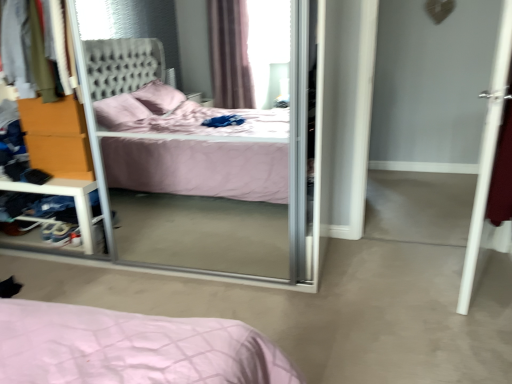
This screenshot has height=384, width=512. Describe the element at coordinates (64, 195) in the screenshot. I see `clear plastic shelf at left` at that location.

Locate an element on the screen. Image resolution: width=512 pixels, height=384 pixels. clear plastic shelf at left is located at coordinates (64, 195).

At what (x,y) coordinates should I click in order to perform the action: click on transparent glass screen door at center. Please return your answer as a coordinate pair (x, y). The width and height of the screenshot is (512, 384). Looking at the image, I should click on tap(202, 169).

Image resolution: width=512 pixels, height=384 pixels. I want to click on white smooth door at right, so [x=487, y=154].

The image size is (512, 384). Identify the location of clothing in front of the orange wood dresser at left. (27, 48).

Is point (79, 107) closer to viewer compared to point (19, 90)?

No, it is behind (19, 90).

What's the angular difference between orange wood dresser at left and velvet fabric sweater at upper left's facing directions?

The angle between the facing direction of orange wood dresser at left and the facing direction of velvet fabric sweater at upper left is 2.08 degrees.

In the scene shown: From the image's perspective, between orange wood dresser at left and clear plastic shelf at left, who is located below?

clear plastic shelf at left.

I want to click on dresser on the right of clear plastic shelf at left, so click(57, 137).

Does point (34, 141) come farther from viewer compared to point (64, 194)?

That is False.

Based on the photo, from a real-world perspective, which is physically below, orange wood dresser at left or clear plastic shelf at left?

clear plastic shelf at left, from a real-world perspective.

Which is more to the right, clear plastic shelf at left or white smooth door at right?

From the viewer's perspective, white smooth door at right appears more on the right side.

What's the angular difference between clear plastic shelf at left and white smooth door at right's facing directions?

110 degrees separate the facing orientations of clear plastic shelf at left and white smooth door at right.

Is clear plastic shelf at left next to white smooth door at right and touching it?

They are not placed beside each other.

Which is closer to the camera, (11, 3) or (74, 181)?

Point (11, 3) is closer to the camera than point (74, 181).

Can you confirm if velvet fabric sweater at upper left is shorter than clear plastic shelf at left?

In fact, velvet fabric sweater at upper left may be taller than clear plastic shelf at left.

The image size is (512, 384). What are the coordinates of `clothing in front of the clear plastic shelf at left` in the screenshot? It's located at (27, 48).

Which object is wider, white smooth door at right or transparent glass screen door at center?

Wider between the two is transparent glass screen door at center.

Is white smooth door at right completely or partially outside of transparent glass screen door at center?

white smooth door at right lies outside transparent glass screen door at center's area.

How many degrees apart are the facing directions of white smooth door at right and transparent glass screen door at center?

The angle between the facing direction of white smooth door at right and the facing direction of transparent glass screen door at center is 111 degrees.

Can you confirm if white smooth door at right is positioned to the right of transparent glass screen door at center?

Yes.

Between velvet fabric sweater at upper left and white smooth door at right, which one appears on the left side from the viewer's perspective?

Positioned to the left is velvet fabric sweater at upper left.

How different are the orientations of velvet fabric sweater at upper left and white smooth door at right in degrees?

There is a 110-degree angle between the facing directions of velvet fabric sweater at upper left and white smooth door at right.

Does point (44, 43) come behind point (506, 71)?

No, (44, 43) is in front of (506, 71).

From the image's perspective, which object appears higher, velvet fabric sweater at upper left or white smooth door at right?

velvet fabric sweater at upper left, from the image's perspective.

Which is in front, clear plastic shelf at left or velvet fabric sweater at upper left?

Positioned in front is velvet fabric sweater at upper left.

Is clear plastic shelf at left surrounding velvet fabric sweater at upper left?

No, velvet fabric sweater at upper left is not inside clear plastic shelf at left.

Is clear plastic shelf at left oriented away from velvet fabric sweater at upper left?

No, clear plastic shelf at left is not facing away from velvet fabric sweater at upper left.

In the scene shown: Based on their sizes in the image, would you say clear plastic shelf at left is bigger or smaller than velvet fabric sweater at upper left?

Considering their sizes, clear plastic shelf at left takes up less space than velvet fabric sweater at upper left.

In order to click on dresser located underneath the velvet fabric sweater at upper left (from a real-world perspective) in this screenshot , I will do 57,137.

Locate an element on the screen. vanity below the orange wood dresser at left (from the image's perspective) is located at coordinates (64, 195).

From the image, which object appears to be nearer to white smooth door at right, clear plastic shelf at left or velvet fabric sweater at upper left?

clear plastic shelf at left.

Looking at the image, which one is located further to orange wood dresser at left, clear plastic shelf at left or white smooth door at right?

The object further to orange wood dresser at left is white smooth door at right.

Considering their positions, is transparent glass screen door at center positioned closer to clear plastic shelf at left than orange wood dresser at left?

The object closer to clear plastic shelf at left is orange wood dresser at left.

Estimate the real-world distances between objects in this image. Which object is closer to clear plastic shelf at left, velvet fabric sweater at upper left or orange wood dresser at left?

Among the two, orange wood dresser at left is located nearer to clear plastic shelf at left.

Looking at the image, which one is located closer to transparent glass screen door at center, velvet fabric sweater at upper left or white smooth door at right?

velvet fabric sweater at upper left is positioned closer to the anchor transparent glass screen door at center.

Looking at the image, which one is located further to orange wood dresser at left, velvet fabric sweater at upper left or clear plastic shelf at left?

velvet fabric sweater at upper left is further to orange wood dresser at left.

Considering their positions, is clear plastic shelf at left positioned closer to white smooth door at right than transparent glass screen door at center?

transparent glass screen door at center is positioned closer to the anchor white smooth door at right.

Looking at the image, which one is located closer to white smooth door at right, transparent glass screen door at center or orange wood dresser at left?

Based on the image, transparent glass screen door at center appears to be nearer to white smooth door at right.

Find the location of a particular element. clothing between transparent glass screen door at center and orange wood dresser at left from front to back is located at coordinates (27, 48).

What are the coordinates of `dresser situated between clear plastic shelf at left and white smooth door at right from left to right` in the screenshot? It's located at (57, 137).

Where is `clothing between clear plastic shelf at left and white smooth door at right in the horizontal direction`? The height and width of the screenshot is (384, 512). clothing between clear plastic shelf at left and white smooth door at right in the horizontal direction is located at coordinates (27, 48).

Where is `screen door between orange wood dresser at left and white smooth door at right`? screen door between orange wood dresser at left and white smooth door at right is located at coordinates (202, 169).